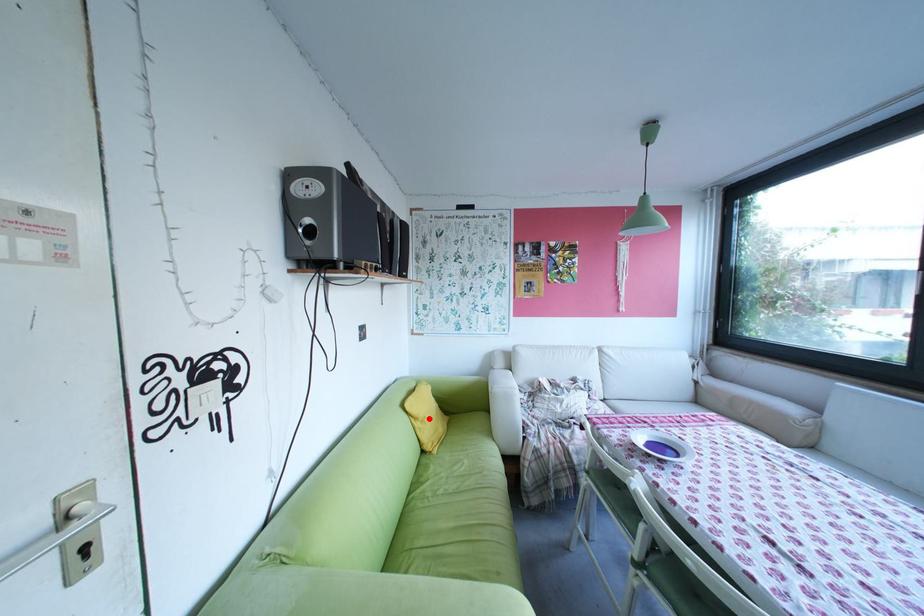
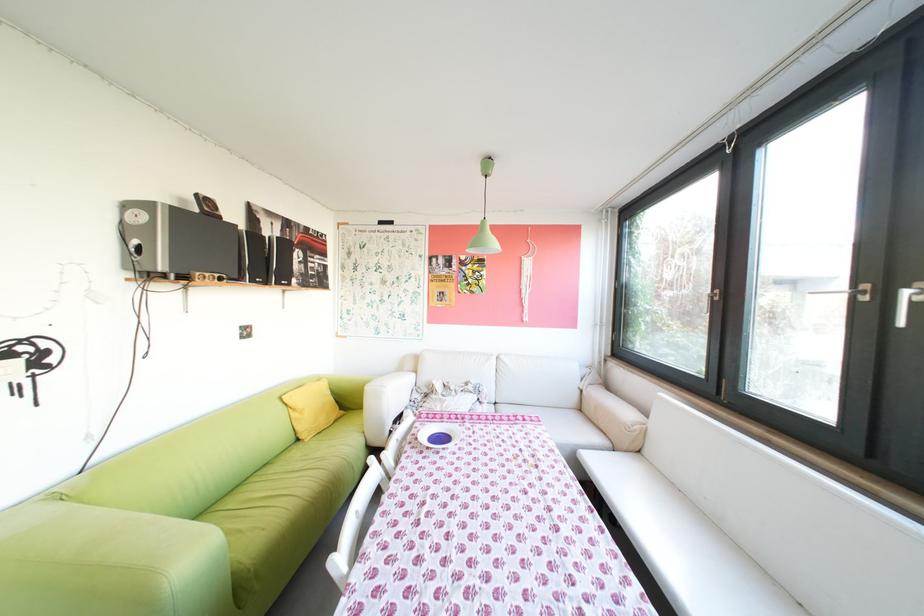
Where in the second image is the point corresponding to the highlighted location from the first image?

(307, 410)